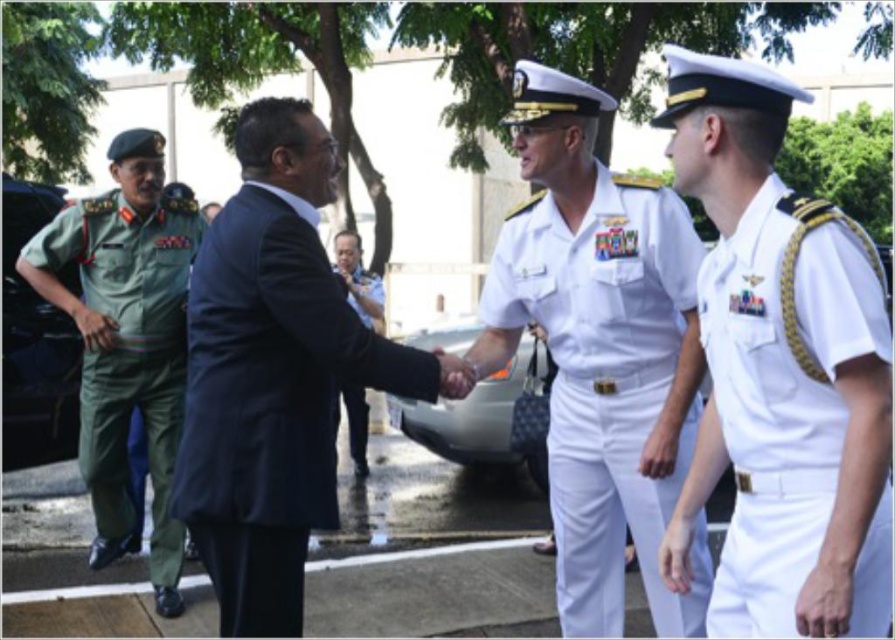
You are a photographer at this event and need to position yourself so that both the white cotton shirt at right and the dark blue suit at center are visible in your shot. Based on their positions, which one should you ensure is closer to the front of your frame to include both?

The white cotton shirt at right is located below the dark blue suit at center, so to include both in the frame, position the camera so the white cotton shirt at right is closer to the front since it is lower and the dark blue suit at center is higher up.

In the image, there are two men in naval uniforms and a man in a dark suit shaking hands. There is also a point at the right side of the scene. Can you tell me what object or person is located at the coordinates point (783, 390)?

Result: The point (783, 390) corresponds to the white cotton shirt at right.

You are standing at the point with coordinates point (x=118, y=396) and want to move to the point with coordinates point (x=712, y=262). Which direction should you move in to reach your destination?

You should move forward to reach point (x=712, y=262) because it is in front of point (x=118, y=396).